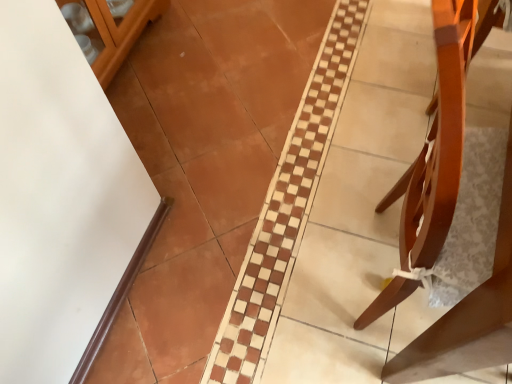
Question: In the image, is white glossy glass door at upper left on the left side or the right side of light brown wood chair at right?

Choices:
 (A) right
 (B) left

Answer: (B)

Question: Based on their sizes in the image, would you say white glossy glass door at upper left is bigger or smaller than light brown wood chair at right?

Choices:
 (A) small
 (B) big

Answer: (A)

Question: In the image, is white glossy glass door at upper left positioned in front of or behind light brown wood chair at right?

Choices:
 (A) front
 (B) behind

Answer: (B)

Question: Is light brown wood chair at right situated inside white glossy glass door at upper left or outside?

Choices:
 (A) inside
 (B) outside

Answer: (B)

Question: Does point (465, 52) appear closer or farther from the camera than point (106, 21)?

Choices:
 (A) farther
 (B) closer

Answer: (B)

Question: From the image's perspective, is light brown wood chair at right located above or below white glossy glass door at upper left?

Choices:
 (A) below
 (B) above

Answer: (A)

Question: Looking at the image, does light brown wood chair at right seem bigger or smaller compared to white glossy glass door at upper left?

Choices:
 (A) big
 (B) small

Answer: (A)